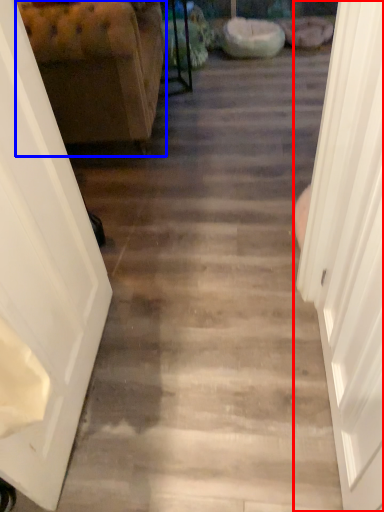
Question: Which point is closer to the camera, door (highlighted by a red box) or furniture (highlighted by a blue box)?

Choices:
 (A) door
 (B) furniture

Answer: (A)